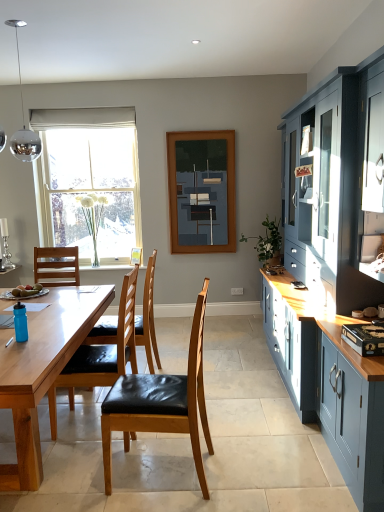
Image resolution: width=384 pixels, height=512 pixels. Find the location of `free spot in front of teal matte water bottle at table left`. free spot in front of teal matte water bottle at table left is located at coordinates (17, 347).